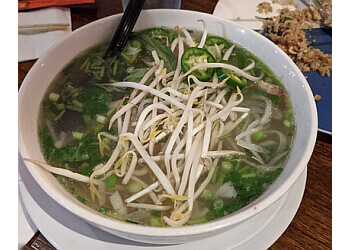
You are a GUI agent. You are given a task and a screenshot of the screen. Output one action in this format:
    pyautogui.click(x=<x>, y=<y>)
    Task: Click on the bowl
    
    Given the screenshot: What is the action you would take?
    pyautogui.click(x=302, y=125)